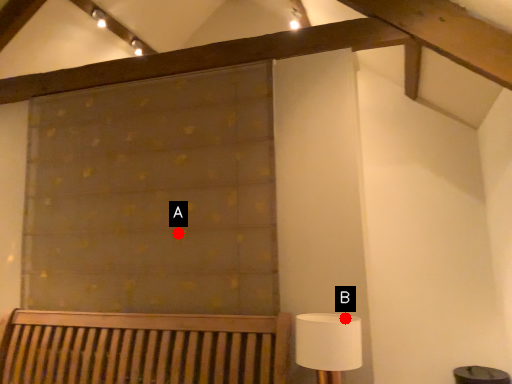
Question: Two points are circled on the image, labeled by A and B beside each circle. Which point is farther from the camera taking this photo?

Choices:
 (A) A is further
 (B) B is further

Answer: (A)